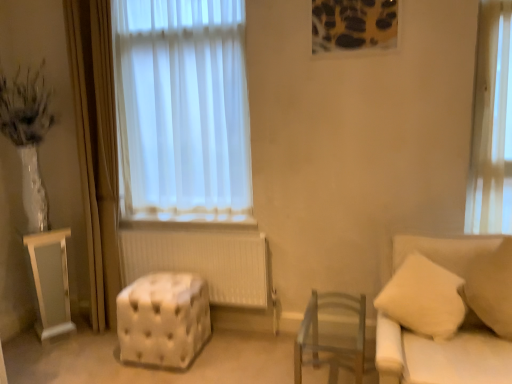
Question: Is clear wood chair at center located outside white glossy cabinet at left?

Choices:
 (A) yes
 (B) no

Answer: (A)

Question: From a real-world perspective, is clear wood chair at center over white glossy cabinet at left?

Choices:
 (A) yes
 (B) no

Answer: (B)

Question: Considering the relative positions of clear wood chair at center and white glossy cabinet at left in the image provided, is clear wood chair at center to the left of white glossy cabinet at left from the viewer's perspective?

Choices:
 (A) yes
 (B) no

Answer: (B)

Question: Considering the relative sizes of clear wood chair at center and white glossy cabinet at left in the image provided, is clear wood chair at center taller than white glossy cabinet at left?

Choices:
 (A) yes
 (B) no

Answer: (B)

Question: Is clear wood chair at center touching white glossy cabinet at left?

Choices:
 (A) no
 (B) yes

Answer: (A)

Question: Is clear wood chair at center oriented towards white glossy cabinet at left?

Choices:
 (A) yes
 (B) no

Answer: (B)

Question: Considering the relative sizes of clear wood chair at center and white tufted ottoman at center in the image provided, is clear wood chair at center thinner than white tufted ottoman at center?

Choices:
 (A) yes
 (B) no

Answer: (B)

Question: Considering the relative sizes of clear wood chair at center and white tufted ottoman at center in the image provided, is clear wood chair at center smaller than white tufted ottoman at center?

Choices:
 (A) no
 (B) yes

Answer: (A)

Question: From the image's perspective, is clear wood chair at center on top of white tufted ottoman at center?

Choices:
 (A) no
 (B) yes

Answer: (A)

Question: From a real-world perspective, is clear wood chair at center on top of white tufted ottoman at center?

Choices:
 (A) no
 (B) yes

Answer: (B)

Question: Considering the relative sizes of clear wood chair at center and white tufted ottoman at center in the image provided, is clear wood chair at center shorter than white tufted ottoman at center?

Choices:
 (A) no
 (B) yes

Answer: (A)

Question: Considering the relative positions of clear wood chair at center and white tufted ottoman at center in the image provided, is clear wood chair at center behind white tufted ottoman at center?

Choices:
 (A) yes
 (B) no

Answer: (B)

Question: From a real-world perspective, does white fabric couch at right sit lower than white tufted ottoman at center?

Choices:
 (A) yes
 (B) no

Answer: (B)